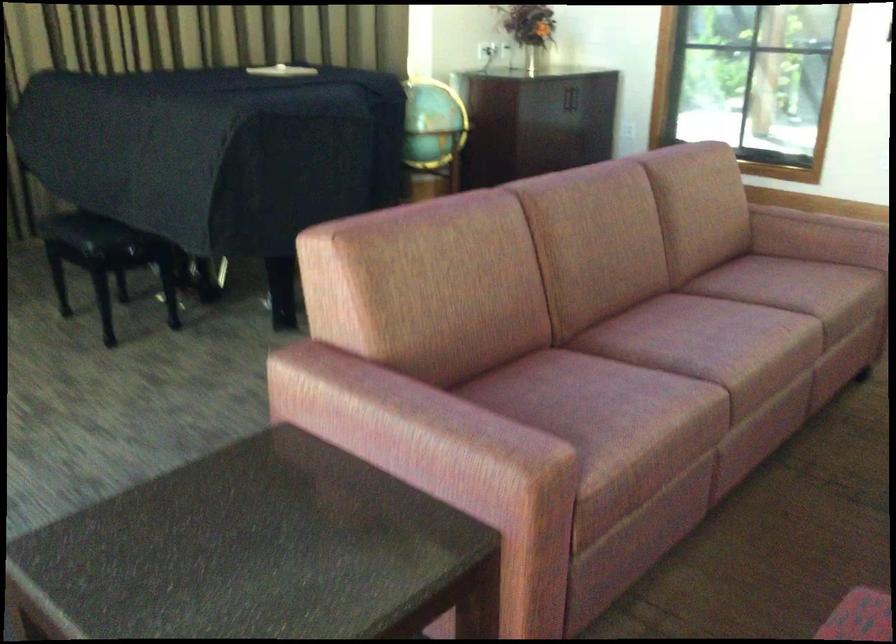
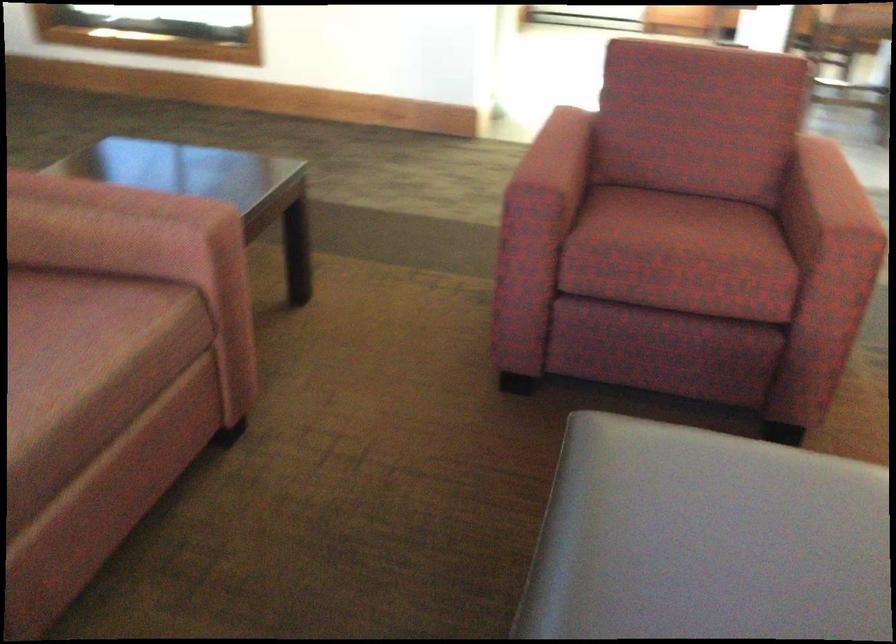
In a continuous first-person perspective shot, in which direction is the camera moving?

The movement direction of the cameraman is right, forward.